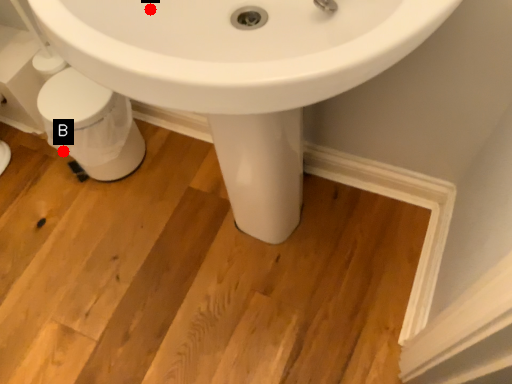
Question: Two points are circled on the image, labeled by A and B beside each circle. Which point is further to the camera?

Choices:
 (A) A is further
 (B) B is further

Answer: (B)